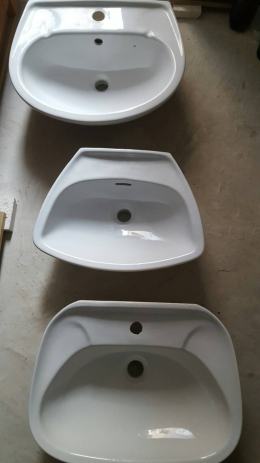
Where is `back of sink`? This screenshot has width=260, height=463. back of sink is located at coordinates (130, 303), (126, 154), (131, 2).